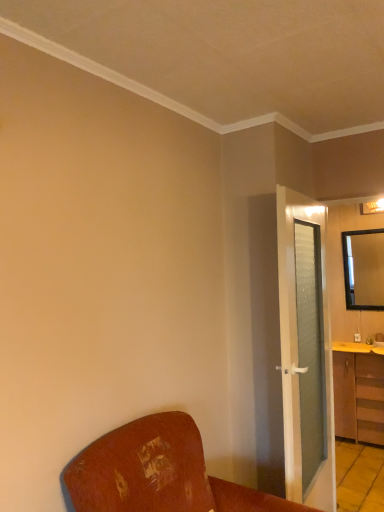
Question: Are green frosted glass door at right and wooden chair at lower left making contact?

Choices:
 (A) yes
 (B) no

Answer: (B)

Question: Is green frosted glass door at right facing towards wooden chair at lower left?

Choices:
 (A) no
 (B) yes

Answer: (A)

Question: Is the depth of green frosted glass door at right greater than that of wooden chair at lower left?

Choices:
 (A) yes
 (B) no

Answer: (A)

Question: Considering the relative positions of green frosted glass door at right and wooden chair at lower left in the image provided, is green frosted glass door at right to the left of wooden chair at lower left from the viewer's perspective?

Choices:
 (A) no
 (B) yes

Answer: (A)

Question: Is green frosted glass door at right taller than wooden chair at lower left?

Choices:
 (A) no
 (B) yes

Answer: (B)

Question: Is point (292, 454) closer or farther from the camera than point (377, 348)?

Choices:
 (A) farther
 (B) closer

Answer: (B)

Question: From the image's perspective, relative to yellow wood counter top at right, is green frosted glass door at right above or below?

Choices:
 (A) above
 (B) below

Answer: (A)

Question: Considering their positions, is green frosted glass door at right located in front of or behind yellow wood counter top at right?

Choices:
 (A) front
 (B) behind

Answer: (A)

Question: Is green frosted glass door at right wider or thinner than yellow wood counter top at right?

Choices:
 (A) thin
 (B) wide

Answer: (A)

Question: From a real-world perspective, is wooden chair at lower left above or below yellow wood counter top at right?

Choices:
 (A) below
 (B) above

Answer: (A)

Question: Relative to yellow wood counter top at right, is wooden chair at lower left in front or behind?

Choices:
 (A) behind
 (B) front

Answer: (B)

Question: Based on their positions, is wooden chair at lower left located to the left or right of yellow wood counter top at right?

Choices:
 (A) right
 (B) left

Answer: (B)

Question: Looking at the image, does wooden chair at lower left seem bigger or smaller compared to yellow wood counter top at right?

Choices:
 (A) big
 (B) small

Answer: (A)

Question: From the image's perspective, is wooden cabinet at right above or below black framed mirror at upper right?

Choices:
 (A) below
 (B) above

Answer: (A)

Question: Would you say wooden cabinet at right is to the left or to the right of black framed mirror at upper right in the picture?

Choices:
 (A) left
 (B) right

Answer: (A)